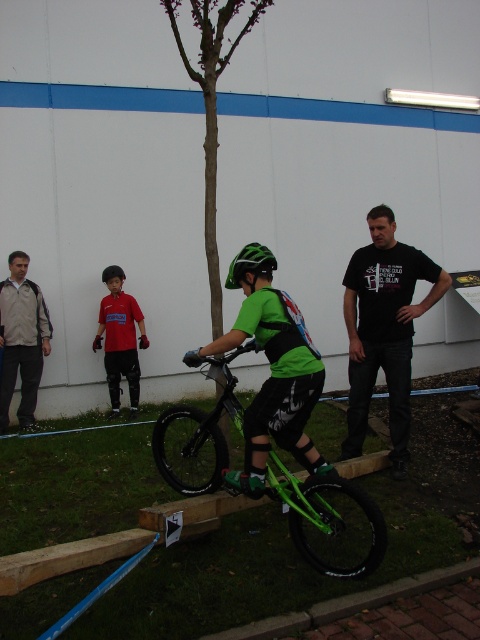
In the scene shown: Does black t-shirt at center lie behind red shirt at center?

No, it is in front of red shirt at center.

Is point (369, 348) less distant than point (120, 378)?

That is True.

Is point (389, 320) positioned after point (105, 362)?

No, (389, 320) is in front of (105, 362).

This screenshot has width=480, height=640. I want to click on black t-shirt at center, so click(x=384, y=328).

Does green matte bicycle at center have a larger size compared to black t-shirt at center?

Yes.

Measure the distance between green matte bicycle at center and camera.

green matte bicycle at center is 2.92 meters from camera.

The image size is (480, 640). What are the coordinates of `green matte bicycle at center` in the screenshot? It's located at tap(331, 522).

Consider the image. Is black t-shirt at center positioned before green matte bicycle helmet at center?

No, it is behind green matte bicycle helmet at center.

Who is positioned more to the left, black t-shirt at center or green matte bicycle helmet at center?

From the viewer's perspective, green matte bicycle helmet at center appears more on the left side.

Find the location of `black t-shirt at center`. black t-shirt at center is located at coordinates 384,328.